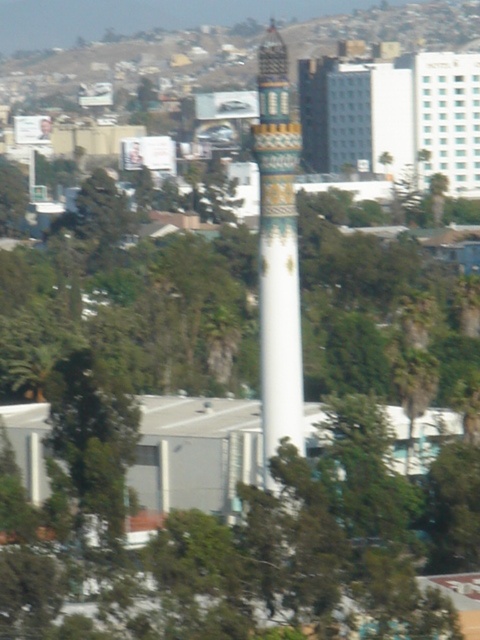
Which of these two, gold mosaic minaret at center or green leafy tree at lower left, stands taller?

With more height is gold mosaic minaret at center.

Does gold mosaic minaret at center appear under green leafy tree at lower left?

Incorrect, gold mosaic minaret at center is not positioned below green leafy tree at lower left.

Which is behind, point (259, 140) or point (110, 515)?

Positioned behind is point (259, 140).

Image resolution: width=480 pixels, height=640 pixels. Find the location of `gold mosaic minaret at center`. gold mosaic minaret at center is located at coordinates (277, 253).